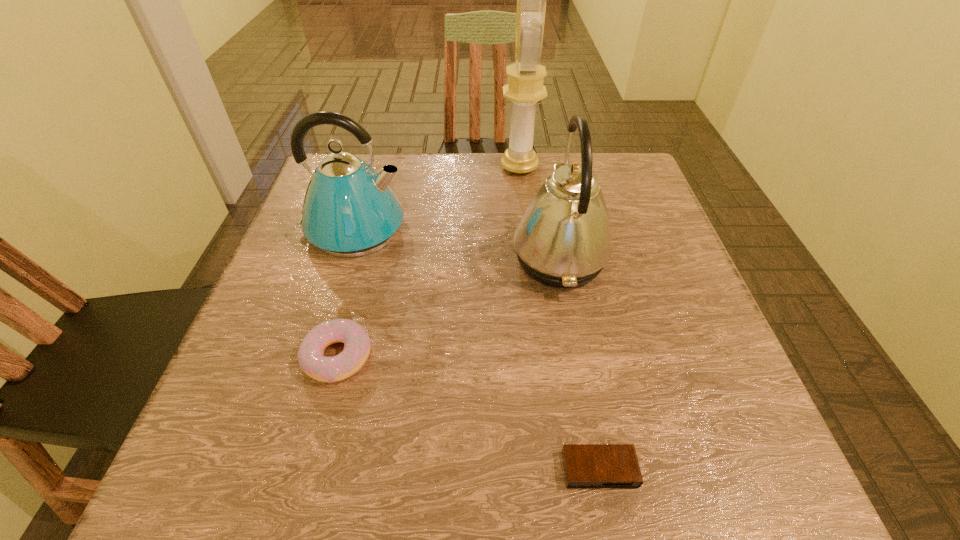
The height and width of the screenshot is (540, 960). In order to click on award in this screenshot , I will do `click(525, 88)`.

Locate an element on the screen. The height and width of the screenshot is (540, 960). the farthest object is located at coordinates click(525, 88).

What are the coordinates of `the right kettle` in the screenshot? It's located at (563, 240).

Where is `the left kettle`? The height and width of the screenshot is (540, 960). the left kettle is located at coordinates (349, 210).

This screenshot has width=960, height=540. In order to click on doughnut in this screenshot , I will do `click(310, 355)`.

Locate an element on the screen. the second nearest object is located at coordinates (310, 355).

Where is `the shortest object`? The image size is (960, 540). the shortest object is located at coordinates tap(585, 465).

This screenshot has height=540, width=960. Find the location of `alarm clock`. alarm clock is located at coordinates (585, 465).

Where is `vacant space located 0.150m on the front-facing side of the farthest object`? The width and height of the screenshot is (960, 540). vacant space located 0.150m on the front-facing side of the farthest object is located at coordinates (444, 167).

The image size is (960, 540). What are the coordinates of `free space located 0.360m on the front-facing side of the farthest object` in the screenshot? It's located at (363, 167).